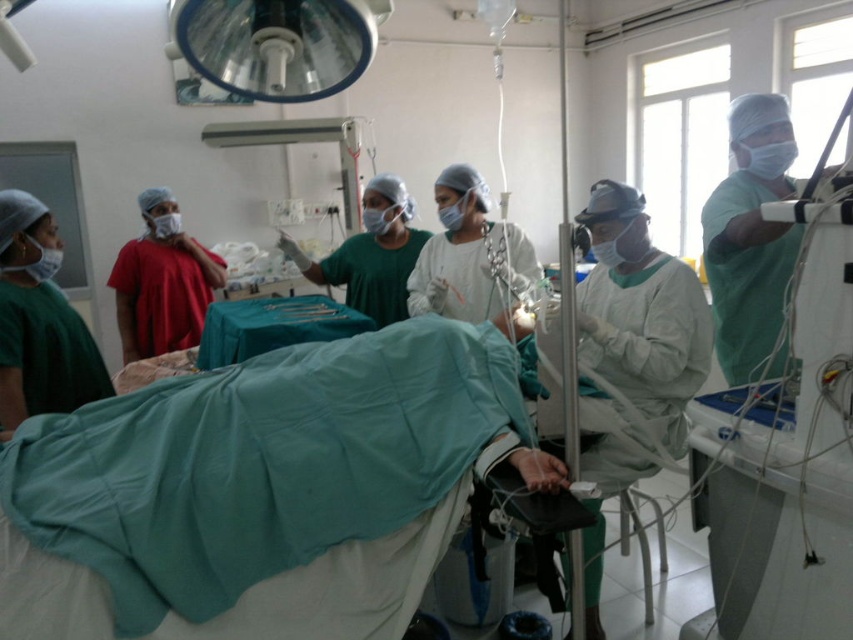
Question: Which of these objects is positioned farthest from the green matte surgical gown at center?

Choices:
 (A) green matte scrubs at right
 (B) metallic surgical instruments at center

Answer: (B)

Question: Estimate the real-world distances between objects in this image. Which object is closer to the green matte scrubs at right?

Choices:
 (A) metallic surgical instruments at center
 (B) green matte surgical gown at center

Answer: (B)

Question: Does green matte surgical gown at center appear on the left side of metallic surgical instruments at center?

Choices:
 (A) no
 (B) yes

Answer: (A)

Question: Among these objects, which one is nearest to the camera?

Choices:
 (A) metallic surgical instruments at center
 (B) green matte surgical gown at center
 (C) green matte scrubs at right

Answer: (B)

Question: Can you confirm if green matte surgical gown at center is bigger than green matte scrubs at right?

Choices:
 (A) yes
 (B) no

Answer: (A)

Question: Can you confirm if green matte scrubs at right is positioned to the left of metallic surgical instruments at center?

Choices:
 (A) no
 (B) yes

Answer: (A)